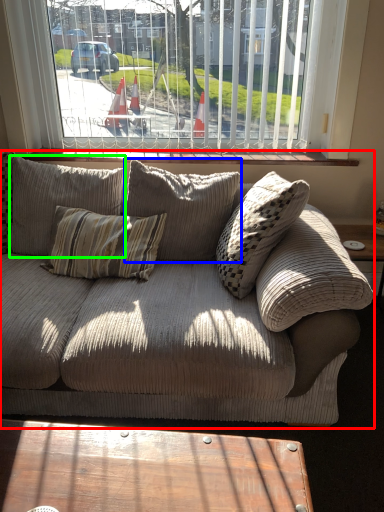
Question: Considering the real-world distances, which object is closest to studio couch (highlighted by a red box)? pillow (highlighted by a blue box) or pillow (highlighted by a green box).

Choices:
 (A) pillow
 (B) pillow

Answer: (A)